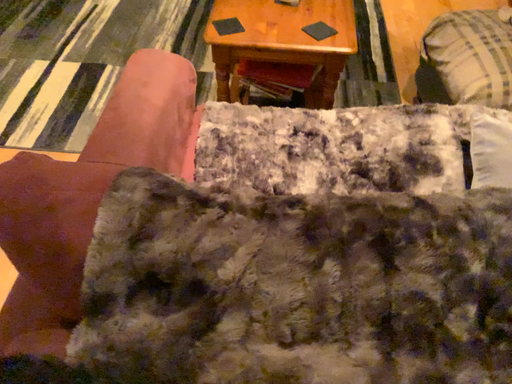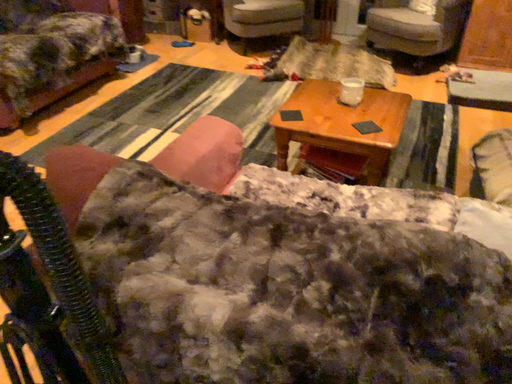
Question: Which way did the camera rotate in the video?

Choices:
 (A) rotated right
 (B) rotated left

Answer: (B)